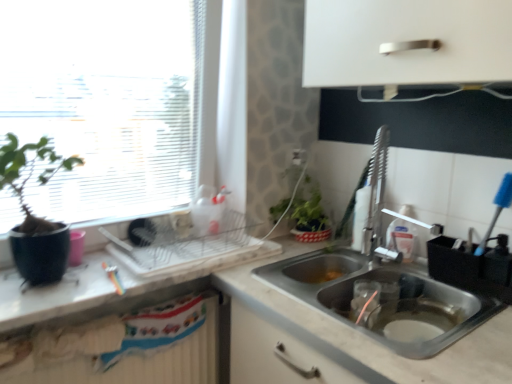
Question: From the image's perspective, is matte black pot at left above or below stainless steel sink at lower right, acting as the 2th sink starting from the bottom?

Choices:
 (A) below
 (B) above

Answer: (A)

Question: In terms of size, does matte black pot at left appear bigger or smaller than stainless steel sink at lower right, which is the first sink in top-to-bottom order?

Choices:
 (A) small
 (B) big

Answer: (A)

Question: Estimate the real-world distances between objects in this image. Which object is closer to the matte black pot at left?

Choices:
 (A) stainless steel sink at lower right, which is the first sink in top-to-bottom order
 (B) white textured radiator at lower left
 (C) stainless steel sink at lower right, the first sink ordered from the bottom
 (D) transparent glass window at upper left
 (E) black plastic utensil holder at sink, acting as the 2th appliance starting from the left

Answer: (D)

Question: Which is nearer to the stainless steel sink at lower right, acting as the second sink starting from the top?

Choices:
 (A) white marble countertop at lower right, which appears as the second countertop when viewed from the top
 (B) metallic dish rack at center, the second appliance positioned from the right
 (C) stainless steel sink at lower right, acting as the 2th sink starting from the bottom
 (D) black plastic utensil holder at sink, acting as the 2th appliance starting from the left
 (E) matte black pot at left

Answer: (C)